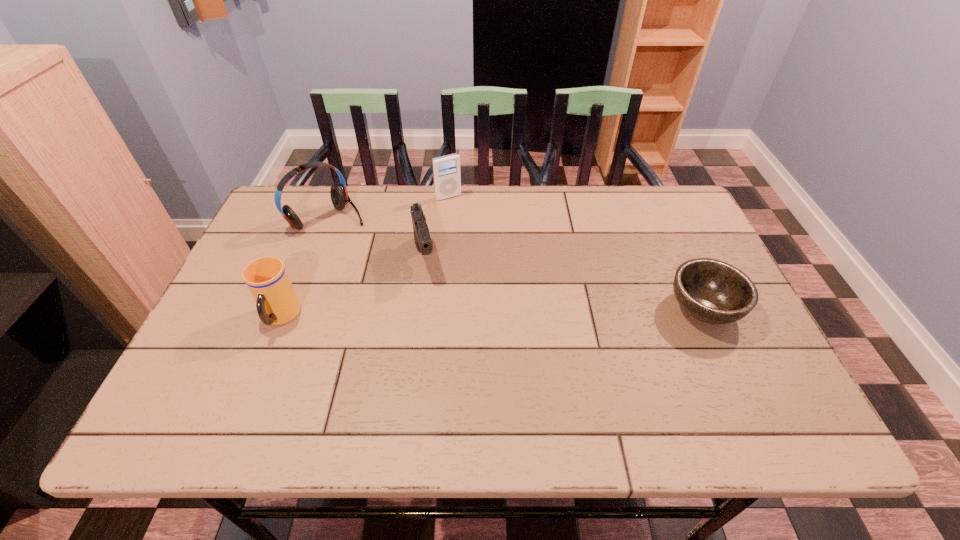
Where is `free point located at the barrel of the pistol`? This screenshot has height=540, width=960. free point located at the barrel of the pistol is located at coordinates (438, 332).

Find the location of a particular element. vacant area situated with the microphone attached to the side of the tallest object is located at coordinates (379, 258).

Identify the location of vacant space located with the microphone attached to the side of the tallest object. This screenshot has height=540, width=960. (372, 251).

You are a GUI agent. You are given a task and a screenshot of the screen. Output one action in this format:
    pyautogui.click(x=<x>, y=<y>)
    Task: Click on the free space located with the microphone attached to the side of the tallest object
    
    Given the screenshot: What is the action you would take?
    pyautogui.click(x=406, y=282)

Locate an element on the screen. The height and width of the screenshot is (540, 960). free region located on the front-facing side of the farthest object is located at coordinates (500, 272).

At what (x,y) coordinates should I click in order to perform the action: click on free location located on the front-facing side of the farthest object. Please return your answer as a coordinate pair (x, y). The image size is (960, 540). Looking at the image, I should click on (459, 210).

You are a GUI agent. You are given a task and a screenshot of the screen. Output one action in this format:
    pyautogui.click(x=<x>, y=<y>)
    Task: Click on the free spot located 0.290m on the front-facing side of the farthest object
    
    Given the screenshot: What is the action you would take?
    pyautogui.click(x=492, y=260)

Locate an element on the screen. The width and height of the screenshot is (960, 540). headset that is at the far edge is located at coordinates (338, 192).

Locate an element on the screen. iPod situated at the far edge is located at coordinates (446, 169).

Find the location of a particular element. This screenshot has width=960, height=540. cup at the left edge is located at coordinates (266, 278).